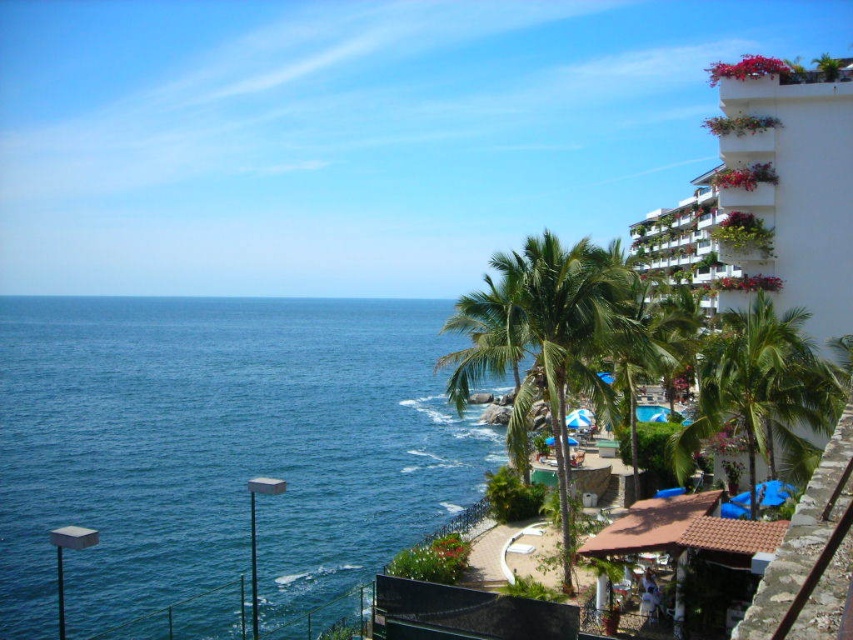
Question: From the image, what is the correct spatial relationship of blue water at left in relation to white glossy building at upper right?

Choices:
 (A) left
 (B) right

Answer: (A)

Question: Which object appears closest to the camera in this image?

Choices:
 (A) green leafy palm tree at center
 (B) green leafy palm tree at right
 (C) white glossy building at upper right

Answer: (A)

Question: Does blue water at left appear on the right side of green leafy palm tree at center?

Choices:
 (A) yes
 (B) no

Answer: (B)

Question: Which of the following is the closest to the observer?

Choices:
 (A) blue water at left
 (B) green leafy palm tree at right

Answer: (B)

Question: Which object is the farthest from the blue water at left?

Choices:
 (A) green leafy palm tree at center
 (B) green leafy palm tree at right

Answer: (B)

Question: Can you confirm if blue water at left is thinner than green leafy palm tree at right?

Choices:
 (A) yes
 (B) no

Answer: (B)